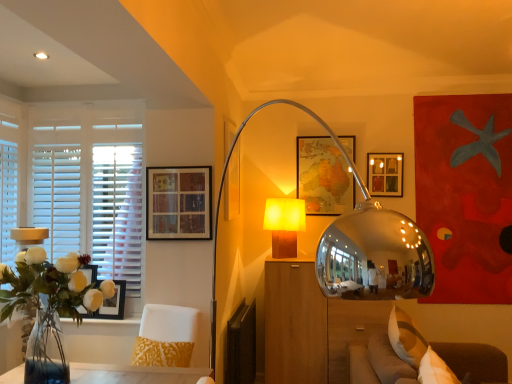
Question: From the image's perspective, is matte wooden picture frame at center, positioned as the 1th picture frame in back-to-front order, under matte black picture frame at left, placed as the 2th picture frame when sorted from front to back?

Choices:
 (A) no
 (B) yes

Answer: (A)

Question: Does matte wooden picture frame at center, the fifth picture frame when ordered from front to back, have a lesser height compared to matte black picture frame at left, the 1th picture frame from the left?

Choices:
 (A) yes
 (B) no

Answer: (B)

Question: From the image's perspective, is matte wooden picture frame at center, positioned as the 1th picture frame in back-to-front order, over matte black picture frame at left, placed as the 2th picture frame when sorted from front to back?

Choices:
 (A) yes
 (B) no

Answer: (A)

Question: Is matte wooden picture frame at center, the 2th picture frame in the right-to-left sequence, thinner than matte black picture frame at left, the 1th picture frame from the left?

Choices:
 (A) no
 (B) yes

Answer: (B)

Question: From a real-world perspective, is matte wooden picture frame at center, the 2th picture frame in the right-to-left sequence, under matte black picture frame at left, which is counted as the fourth picture frame, starting from the back?

Choices:
 (A) yes
 (B) no

Answer: (B)

Question: Is matte black picture frame at left, the fifth picture frame positioned from the right, situated inside white fabric pillow at lower right or outside?

Choices:
 (A) outside
 (B) inside

Answer: (A)

Question: From a real-world perspective, is matte black picture frame at left, the fifth picture frame positioned from the right, positioned above or below white fabric pillow at lower right?

Choices:
 (A) below
 (B) above

Answer: (B)

Question: From their relative heights in the image, would you say matte black picture frame at left, the 1th picture frame from the left, is taller or shorter than white fabric pillow at lower right?

Choices:
 (A) tall
 (B) short

Answer: (B)

Question: Relative to white fabric pillow at lower right, is matte black picture frame at left, which is counted as the fourth picture frame, starting from the back, in front or behind?

Choices:
 (A) front
 (B) behind

Answer: (B)

Question: In the image, is matte black picture frame at left, which is counted as the fourth picture frame, starting from the back, positioned in front of or behind clear glass vase at left?

Choices:
 (A) behind
 (B) front

Answer: (A)

Question: Based on their positions, is matte black picture frame at left, which is counted as the fourth picture frame, starting from the back, located to the left or right of clear glass vase at left?

Choices:
 (A) left
 (B) right

Answer: (A)

Question: From a real-world perspective, is matte black picture frame at left, the fifth picture frame positioned from the right, physically located above or below clear glass vase at left?

Choices:
 (A) below
 (B) above

Answer: (A)

Question: Is matte black picture frame at left, placed as the 2th picture frame when sorted from front to back, taller or shorter than clear glass vase at left?

Choices:
 (A) short
 (B) tall

Answer: (A)

Question: Do you think wooden dresser at center is within white fabric pillow at lower right, or outside of it?

Choices:
 (A) outside
 (B) inside

Answer: (A)

Question: Is wooden dresser at center to the left or to the right of white fabric pillow at lower right in the image?

Choices:
 (A) right
 (B) left

Answer: (B)